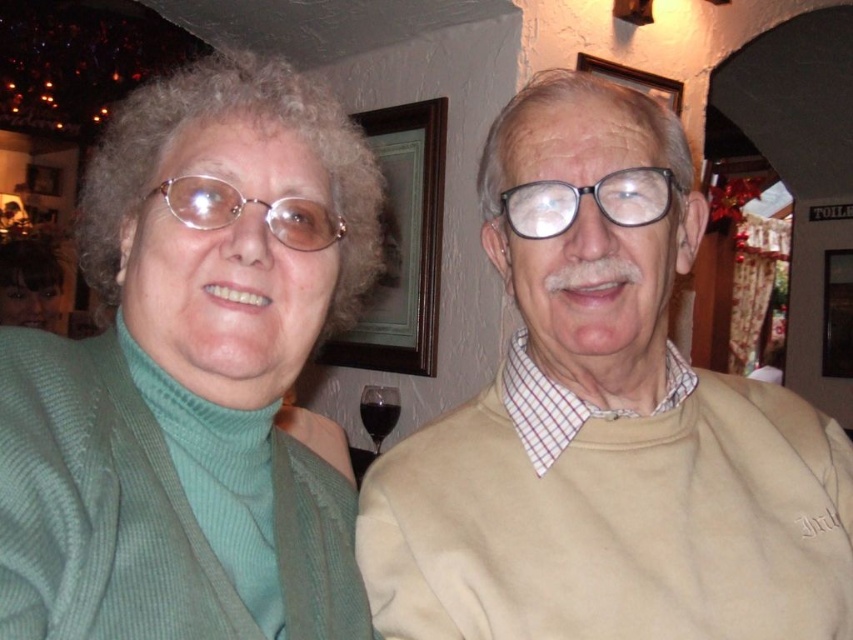
Does green ribbed turtleneck sweater at left have a greater width compared to transparent glass at lower center?

Correct, the width of green ribbed turtleneck sweater at left exceeds that of transparent glass at lower center.

This screenshot has height=640, width=853. I want to click on green ribbed turtleneck sweater at left, so click(x=192, y=376).

The height and width of the screenshot is (640, 853). Identify the location of green ribbed turtleneck sweater at left. (192, 376).

Who is higher up, green ribbed turtleneck sweater at left or smooth brown hair at upper left?

smooth brown hair at upper left is above.

Based on the photo, does green ribbed turtleneck sweater at left appear on the left side of smooth brown hair at upper left?

Incorrect, green ribbed turtleneck sweater at left is not on the left side of smooth brown hair at upper left.

Where is `green ribbed turtleneck sweater at left`? green ribbed turtleneck sweater at left is located at coordinates pos(192,376).

Is smooth brown hair at upper left closer to the viewer compared to transparent glass at lower center?

No, it is behind transparent glass at lower center.

Is smooth brown hair at upper left positioned behind transparent glass at lower center?

That is True.

This screenshot has height=640, width=853. Find the location of `smooth brown hair at upper left`. smooth brown hair at upper left is located at coordinates (28, 284).

The width and height of the screenshot is (853, 640). What are the coordinates of `smooth brown hair at upper left` in the screenshot? It's located at (28, 284).